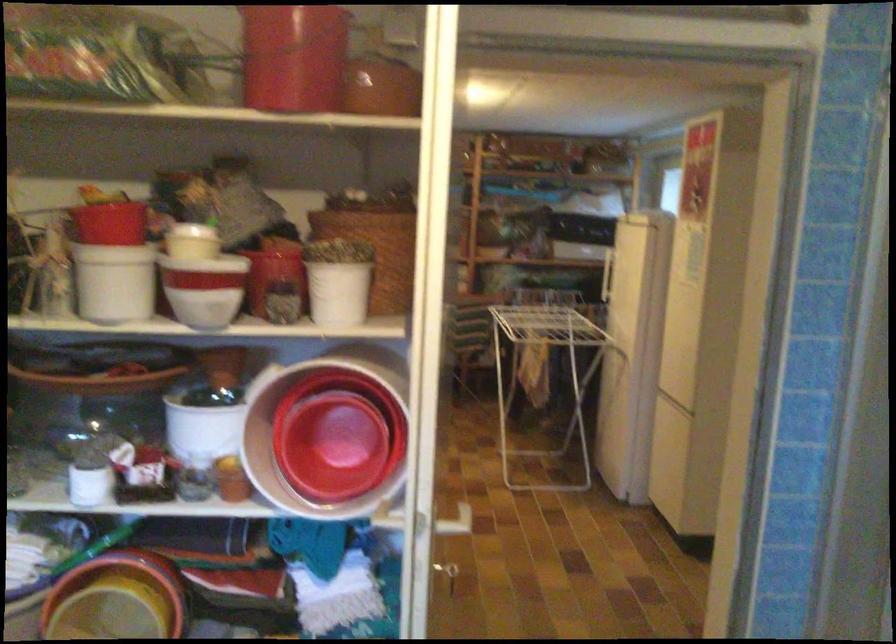
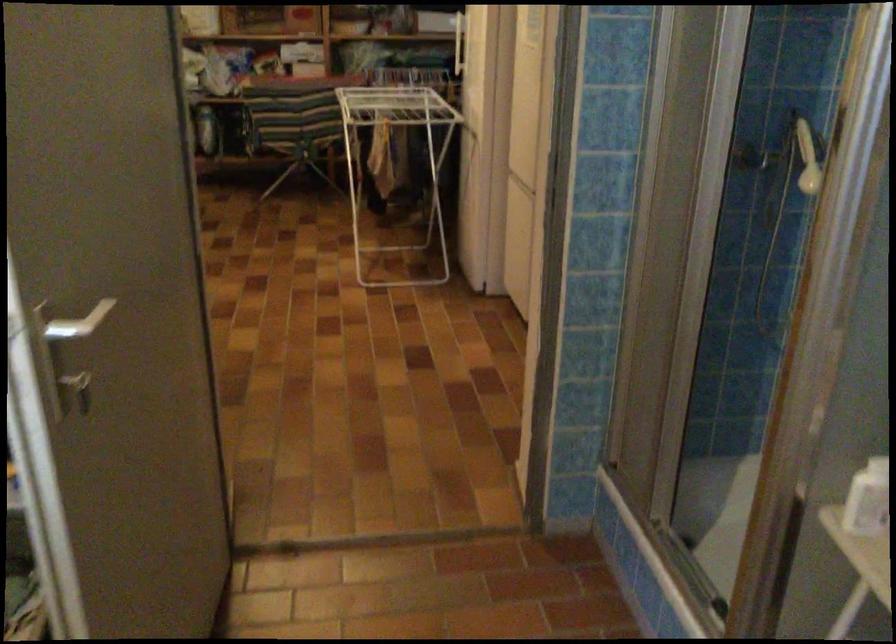
Question: The first image is from the beginning of the video and the second image is from the end. How did the camera likely rotate when shooting the video?

Choices:
 (A) Left
 (B) Right
 (C) Up
 (D) Down

Answer: (D)